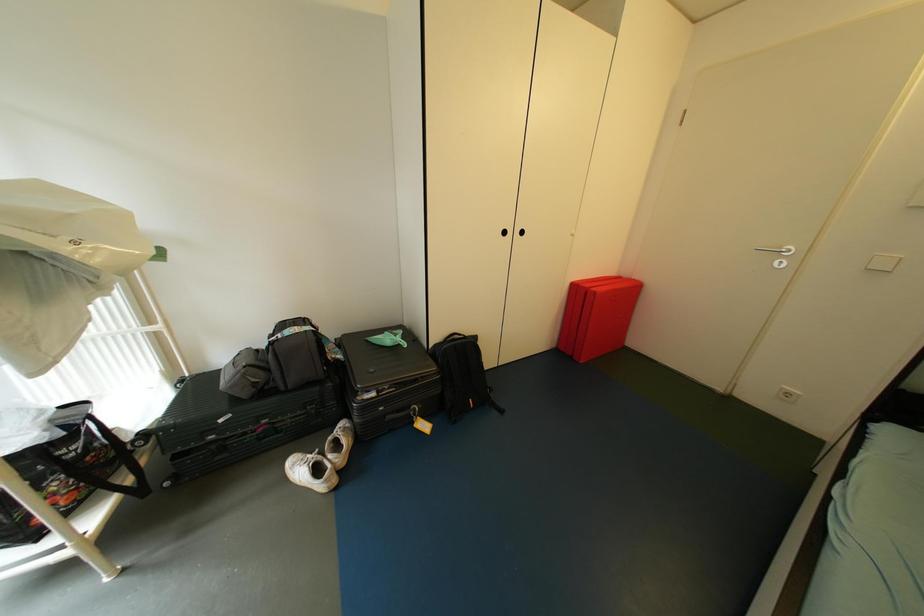
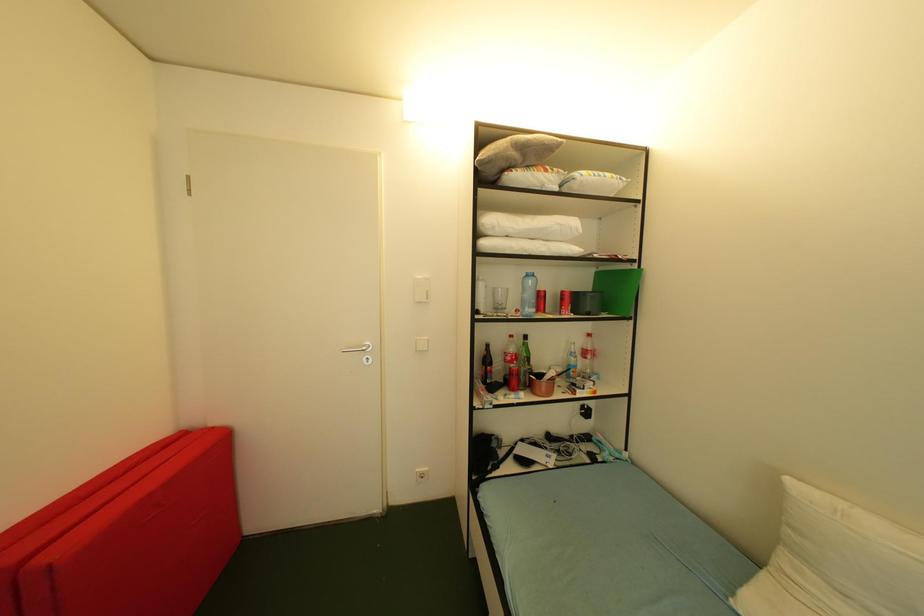
Question: How did the camera likely rotate?

Choices:
 (A) Left
 (B) Right
 (C) Up
 (D) Down

Answer: (B)